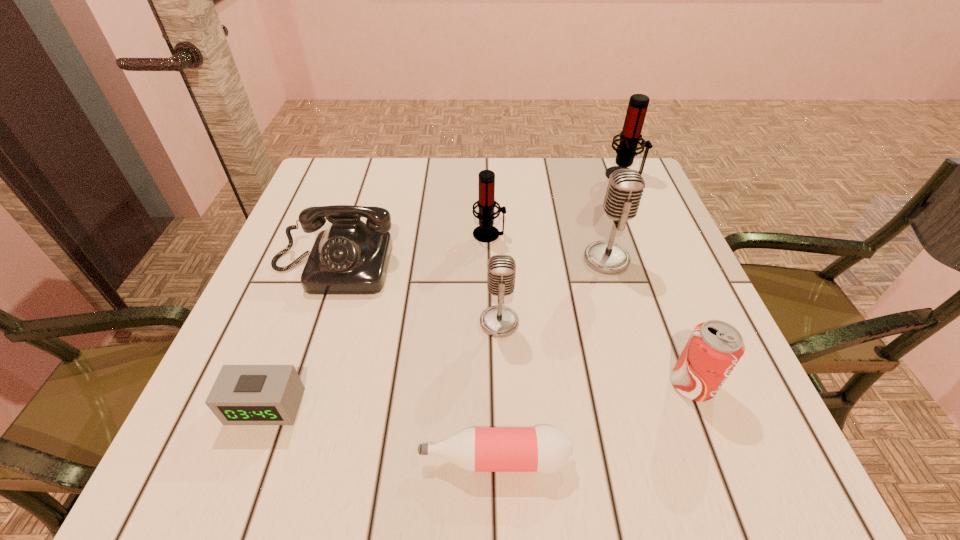
This screenshot has width=960, height=540. I want to click on empty space between the pink soda can and the farthest object, so click(x=658, y=280).

You are a GUI agent. You are given a task and a screenshot of the screen. Output one action in this format:
    pyautogui.click(x=<x>, y=<y>)
    Task: Click on the free space between the right gray microphone and the alarm clock
    
    Given the screenshot: What is the action you would take?
    pyautogui.click(x=436, y=332)

At what (x,y) coordinates should I click in order to perform the action: click on vacant area that lies between the alarm clock and the fourth nearest object. Please return your answer as a coordinate pair (x, y). This screenshot has height=540, width=960. Looking at the image, I should click on (382, 364).

The height and width of the screenshot is (540, 960). Find the location of `blank region between the alarm clock and the nearer red microphone`. blank region between the alarm clock and the nearer red microphone is located at coordinates (377, 320).

Locate an element on the screen. This screenshot has height=540, width=960. empty location between the alarm clock and the pink soda can is located at coordinates (479, 395).

Identify the location of unoccupied area between the farther red microphone and the nearest object. (560, 317).

Where is `object that stands as the closest to the nearest object`? The width and height of the screenshot is (960, 540). object that stands as the closest to the nearest object is located at coordinates (499, 321).

Locate an element on the screen. The height and width of the screenshot is (540, 960). the sixth closest object relative to the alarm clock is located at coordinates (714, 348).

Choose which microphone is the second nearest neighbor to the second farthest microphone. Please provide its 2D coordinates. Your answer should be formatted as a tuple, i.e. [(x, y)], where the tuple contains the x and y coordinates of a point satisfying the conditions above.

[(499, 321)]

Point out which microphone is positioned as the third nearest to the soda can. Please provide its 2D coordinates. Your answer should be formatted as a tuple, i.e. [(x, y)], where the tuple contains the x and y coordinates of a point satisfying the conditions above.

[(485, 232)]